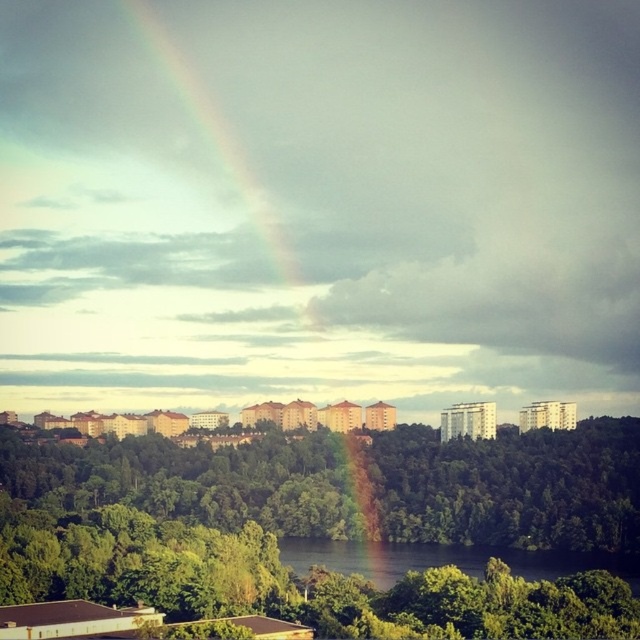
You are standing in a park and see the green leafy tree at center. If you want to reach the tree within 10 seconds, what is the minimum running speed you need to maintain?

The green leafy tree at center is 173.44 meters away from viewer. To reach it within 10 seconds, you need to run at a minimum speed of 17.34 meters per second.

You are a drone operator planning to fly a drone from the green leafy tree at center to the rainbow at upper center. The drone has a maximum flight range of 70 meters. Can the drone make the trip without needing a recharge?

The distance between the green leafy tree at center and the rainbow at upper center is 69.68 meters, which is within the drone operator drone has a maximum flight range of 70 meters. The drone can make the trip without needing a recharge.

You are a bird flying over the urban landscape. You want to land on the green leafy tree at center but need to avoid the rainbow at upper center. Is the tree blocking your view of the rainbow?

The green leafy tree at center is in front of the rainbow at upper center, so yes, the tree is blocking your view of the rainbow.